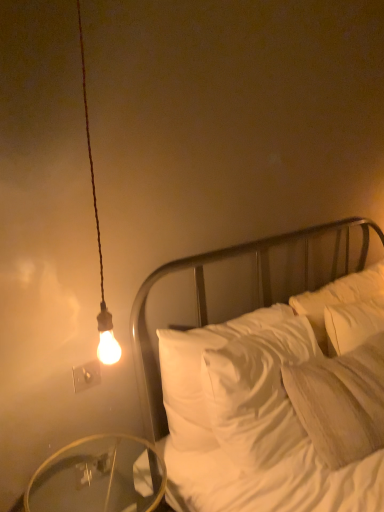
Question: Could you tell me if transparent glass table at lower left is facing white satin bed at center?

Choices:
 (A) no
 (B) yes

Answer: (A)

Question: Considering the relative sizes of transparent glass table at lower left and white satin bed at center in the image provided, is transparent glass table at lower left thinner than white satin bed at center?

Choices:
 (A) yes
 (B) no

Answer: (B)

Question: Considering the relative sizes of transparent glass table at lower left and white satin bed at center in the image provided, is transparent glass table at lower left smaller than white satin bed at center?

Choices:
 (A) yes
 (B) no

Answer: (A)

Question: Considering the relative sizes of transparent glass table at lower left and white satin bed at center in the image provided, is transparent glass table at lower left taller than white satin bed at center?

Choices:
 (A) yes
 (B) no

Answer: (B)

Question: Is transparent glass table at lower left bigger than white satin bed at center?

Choices:
 (A) yes
 (B) no

Answer: (B)

Question: Is point (89, 458) positioned closer to the camera than point (97, 360)?

Choices:
 (A) farther
 (B) closer

Answer: (A)

Question: In terms of width, does transparent glass table at lower left look wider or thinner when compared to white plastic electric outlet at upper left?

Choices:
 (A) thin
 (B) wide

Answer: (B)

Question: In the image, is transparent glass table at lower left on the left side or the right side of white plastic electric outlet at upper left?

Choices:
 (A) right
 (B) left

Answer: (A)

Question: Considering the positions of transparent glass table at lower left and white plastic electric outlet at upper left in the image, is transparent glass table at lower left bigger or smaller than white plastic electric outlet at upper left?

Choices:
 (A) small
 (B) big

Answer: (B)

Question: Which is correct: white satin bed at center is inside white soft pillow at right, or outside of it?

Choices:
 (A) outside
 (B) inside

Answer: (A)

Question: Considering their positions, is white satin bed at center located in front of or behind white soft pillow at right?

Choices:
 (A) behind
 (B) front

Answer: (B)

Question: Considering the relative positions of white satin bed at center and white soft pillow at right in the image provided, is white satin bed at center to the left or to the right of white soft pillow at right?

Choices:
 (A) left
 (B) right

Answer: (A)

Question: From a real-world perspective, is white satin bed at center above or below white soft pillow at right?

Choices:
 (A) above
 (B) below

Answer: (B)

Question: Choose the correct answer: Is white soft pillow at right inside white plastic electric outlet at upper left or outside it?

Choices:
 (A) outside
 (B) inside

Answer: (A)

Question: Is white soft pillow at right to the left or to the right of white plastic electric outlet at upper left in the image?

Choices:
 (A) left
 (B) right

Answer: (B)